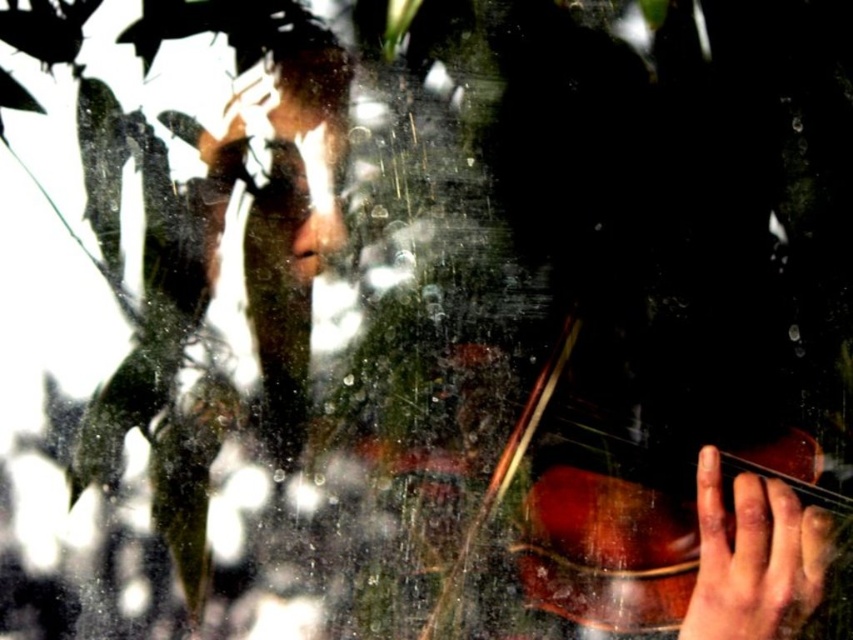
You are a photographer trying to focus on the shiny brown violin at lower right and the smooth skin hand at lower right through the window with water droplets. Which object is closer to the camera?

The shiny brown violin at lower right is closer to the camera than the smooth skin hand at lower right.